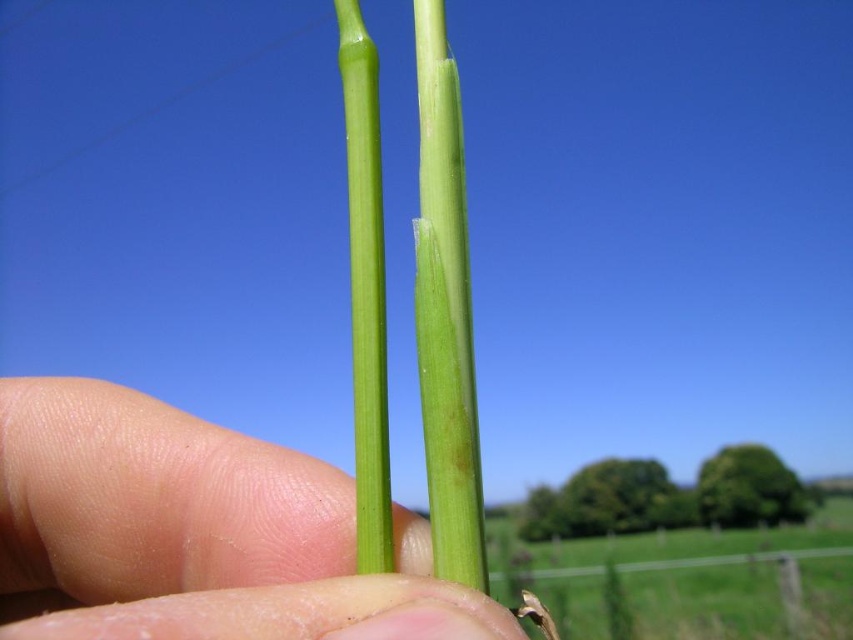
From the picture: Is green smooth grass at center bigger than green smooth stem at center?

Correct, green smooth grass at center is larger in size than green smooth stem at center.

You are a GUI agent. You are given a task and a screenshot of the screen. Output one action in this format:
    pyautogui.click(x=<x>, y=<y>)
    Task: Click on the green smooth grass at center
    Image resolution: width=853 pixels, height=640 pixels.
    Given the screenshot: What is the action you would take?
    pyautogui.click(x=706, y=582)

Does smooth skin at center lie in front of green smooth stem at center?

Yes, it is in front of green smooth stem at center.

Does point (57, 604) come in front of point (355, 0)?

That is False.

Is point (112, 528) positioned in front of point (376, 352)?

No, it is behind (376, 352).

Find the location of a particular element. The height and width of the screenshot is (640, 853). smooth skin at center is located at coordinates (194, 532).

Is smooth skin at center closer to the viewer compared to green smooth grass at center?

Yes, smooth skin at center is in front of green smooth grass at center.

Between smooth skin at center and green smooth grass at center, which one appears on the right side from the viewer's perspective?

Positioned to the right is green smooth grass at center.

Is point (137, 442) behind point (641, 579)?

That is False.

The width and height of the screenshot is (853, 640). In order to click on smooth skin at center in this screenshot , I will do `click(194, 532)`.